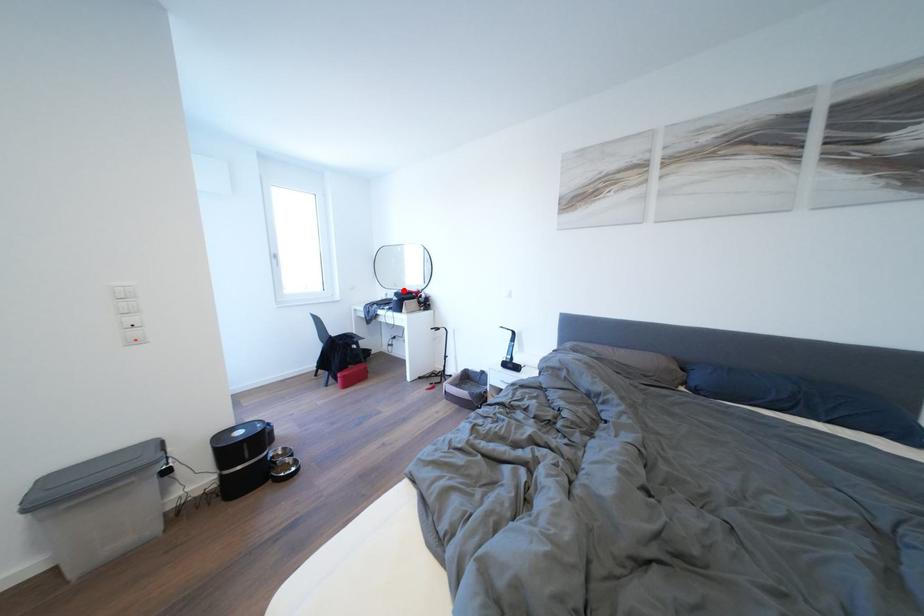
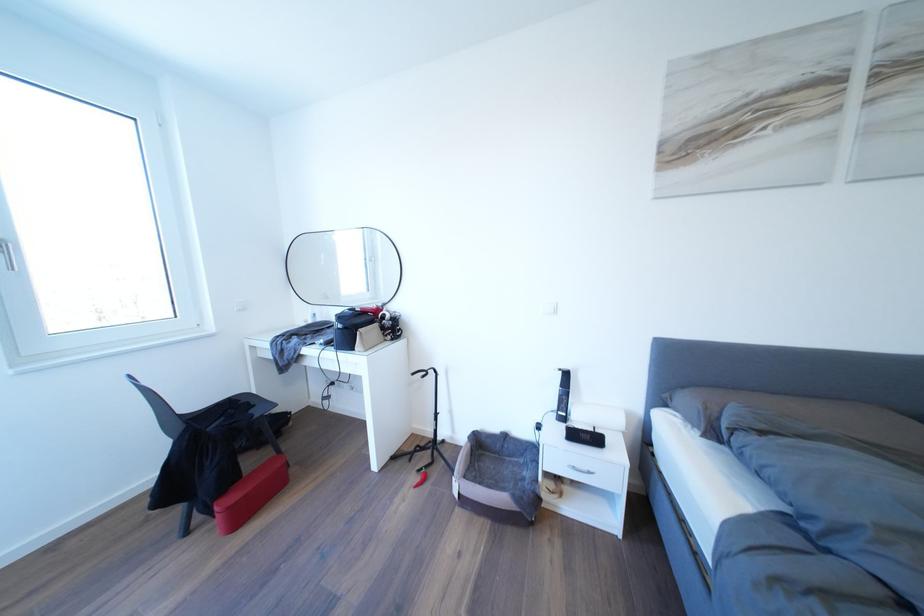
The point at the highlighted location is marked in the first image. Where is the corresponding point in the second image?

(334, 302)